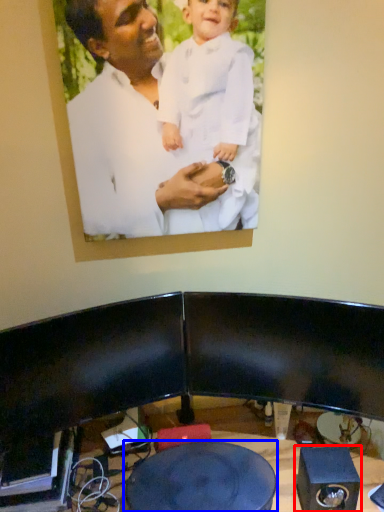
Question: Which object appears farthest to the camera in this image, speaker (highlighted by a red box) or round table (highlighted by a blue box)?

Choices:
 (A) speaker
 (B) round table

Answer: (A)